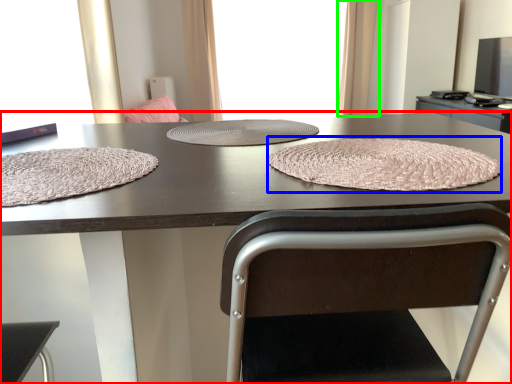
Question: Based on their relative distances, which object is farther from table (highlighted by a red box)? Choose from blanket (highlighted by a blue box) and curtain (highlighted by a green box).

Choices:
 (A) blanket
 (B) curtain

Answer: (B)